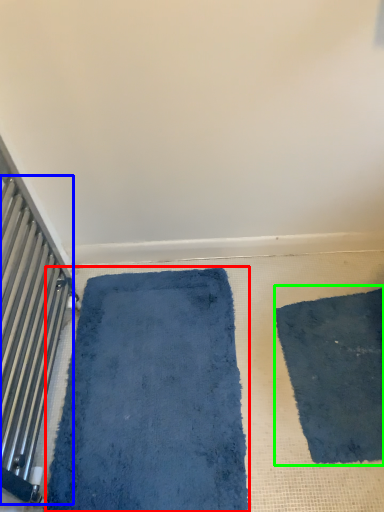
Question: Which is farther away from bath mat (highlighted by a red box)? radiator (highlighted by a blue box) or mat (highlighted by a green box)?

Choices:
 (A) radiator
 (B) mat

Answer: (B)